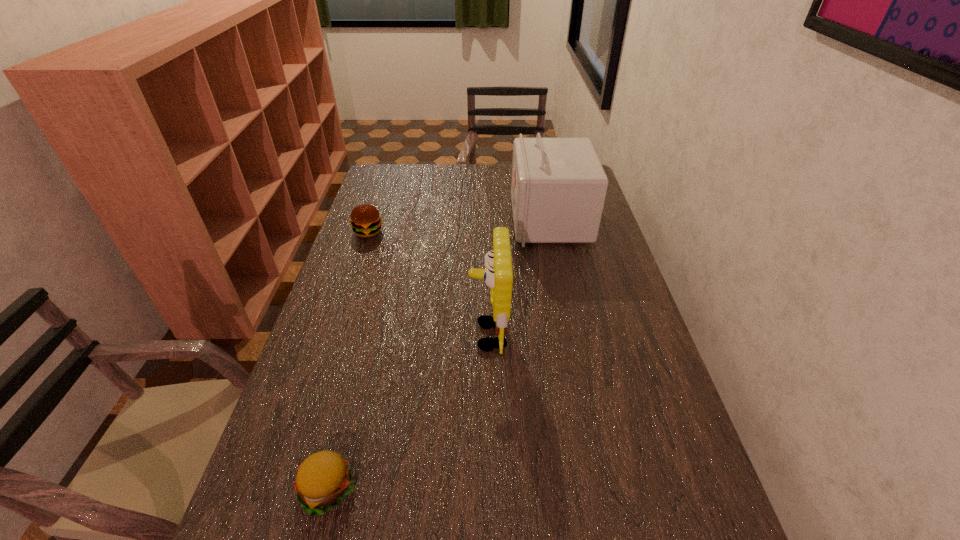
Locate an element on the screen. This screenshot has width=960, height=540. the rightmost object is located at coordinates (558, 189).

Locate an element on the screen. The width and height of the screenshot is (960, 540). the second object from right to left is located at coordinates (498, 276).

Locate an element on the screen. This screenshot has height=540, width=960. sponge is located at coordinates (498, 276).

I want to click on the farther hamburger, so click(366, 221).

The width and height of the screenshot is (960, 540). What are the coordinates of `the second shortest object` in the screenshot? It's located at (366, 221).

Find the location of a particular element. This screenshot has height=540, width=960. the nearest object is located at coordinates (324, 479).

Locate an element on the screen. the shortest object is located at coordinates (324, 479).

You are a GUI agent. You are given a task and a screenshot of the screen. Output one action in this format:
    pyautogui.click(x=<x>, y=<y>)
    Task: Click on the vacant area situated on the front-facing side of the rightmost object
    
    Given the screenshot: What is the action you would take?
    pyautogui.click(x=457, y=220)

Locate an element on the screen. free space located 0.310m on the front-facing side of the rightmost object is located at coordinates (426, 220).

This screenshot has width=960, height=540. I want to click on free space located 0.100m on the front-facing side of the rightmost object, so click(485, 220).